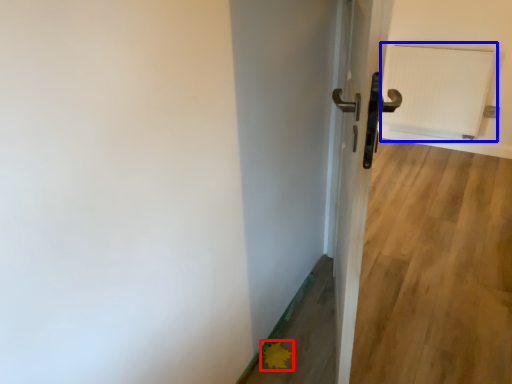
Question: Which object is closer to the camera taking this photo, flower (highlighted by a red box) or radiator (highlighted by a blue box)?

Choices:
 (A) flower
 (B) radiator

Answer: (A)